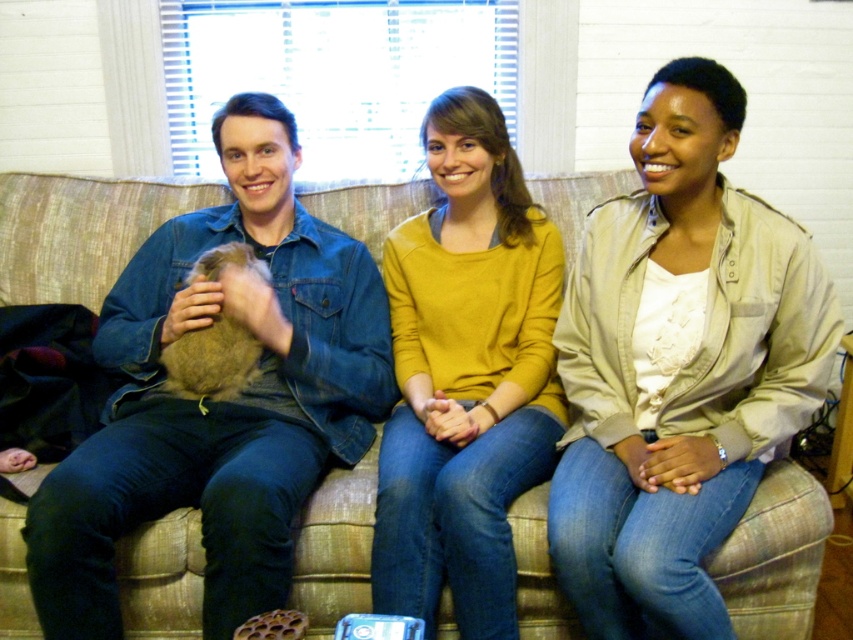
Question: Is beige cotton jacket at center to the left of mustard yellow sweater at center from the viewer's perspective?

Choices:
 (A) no
 (B) yes

Answer: (A)

Question: Which of the following is the farthest from the observer?

Choices:
 (A) beige cotton jacket at center
 (B) mustard yellow sweater at center
 (C) denim jacket at center

Answer: (B)

Question: Which object appears farthest from the camera in this image?

Choices:
 (A) denim jacket at center
 (B) beige cotton jacket at center
 (C) beige fabric couch at center

Answer: (C)

Question: Among these objects, which one is farthest from the camera?

Choices:
 (A) beige cotton jacket at center
 (B) beige fabric couch at center
 (C) mustard yellow sweater at center
 (D) denim jacket at center

Answer: (B)

Question: Is denim jacket at center to the left of beige fabric couch at center from the viewer's perspective?

Choices:
 (A) yes
 (B) no

Answer: (A)

Question: Can you confirm if beige cotton jacket at center is positioned below denim jacket at center?

Choices:
 (A) yes
 (B) no

Answer: (B)